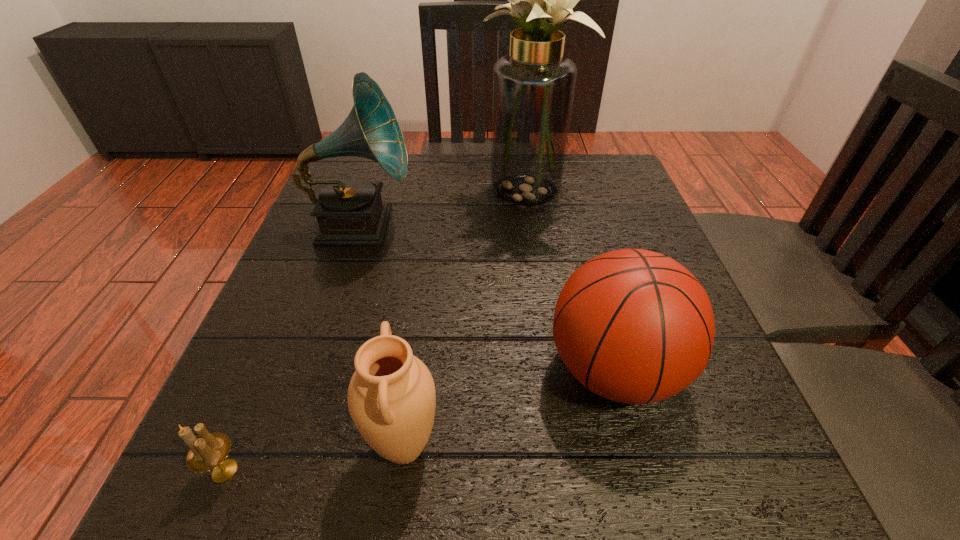
Image resolution: width=960 pixels, height=540 pixels. I want to click on flower arrangement that is at the far edge, so click(533, 88).

Where is `phonograph_record that is at the far edge`? This screenshot has height=540, width=960. phonograph_record that is at the far edge is located at coordinates (350, 211).

Where is `urn located in the near edge section of the desktop`? This screenshot has width=960, height=540. urn located in the near edge section of the desktop is located at coordinates (391, 397).

Where is `candle holder that is at the near edge`? Image resolution: width=960 pixels, height=540 pixels. candle holder that is at the near edge is located at coordinates (209, 451).

What are the coordinates of `phonograph_record located at the left edge` in the screenshot? It's located at (350, 211).

The image size is (960, 540). I want to click on candle holder located at the left edge, so click(x=209, y=451).

Locate an element on the screen. The image size is (960, 540). flower arrangement present at the right edge is located at coordinates (533, 88).

Where is `basketball located at the right edge`? basketball located at the right edge is located at coordinates (634, 326).

This screenshot has height=540, width=960. I want to click on object that is at the far left corner, so click(x=350, y=211).

Where is `object located at the near left corner`? Image resolution: width=960 pixels, height=540 pixels. object located at the near left corner is located at coordinates (209, 451).